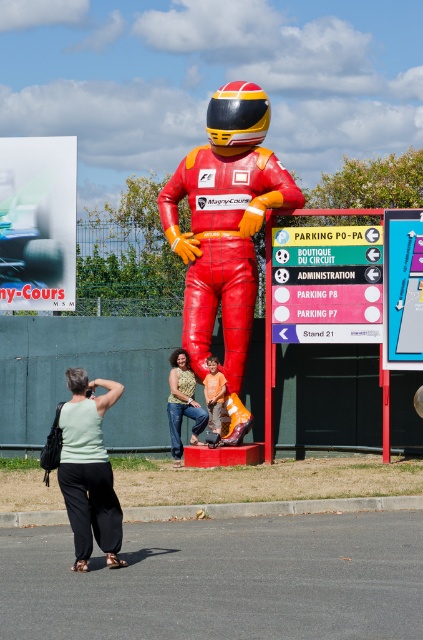
Can you confirm if light green fabric shirt at lower left is wider than shiny black helmet at center?

In fact, light green fabric shirt at lower left might be narrower than shiny black helmet at center.

Can you confirm if light green fabric shirt at lower left is positioned above shiny black helmet at center?

No.

Does point (90, 512) come in front of point (225, 150)?

Yes, point (90, 512) is closer to viewer.

I want to click on light green fabric shirt at lower left, so click(x=88, y=470).

Who is shorter, shiny black helmet at center or jeans at center?

jeans at center

Is point (225, 125) closer to camera compared to point (167, 401)?

That is True.

Does point (260, 100) lie behind point (192, 388)?

No, (260, 100) is closer to viewer.

The image size is (423, 640). What are the coordinates of `shiny black helmet at center` in the screenshot? It's located at (236, 116).

Is shiny red suit at center taller than metallic blue tire at upper left?

Yes.

Does shiny red suit at center have a larger size compared to metallic blue tire at upper left?

Yes, shiny red suit at center is bigger than metallic blue tire at upper left.

Which is in front, point (216, 296) or point (66, 257)?

Point (216, 296) is in front.

Find the location of a particular element. This screenshot has width=423, height=640. shiny red suit at center is located at coordinates (225, 230).